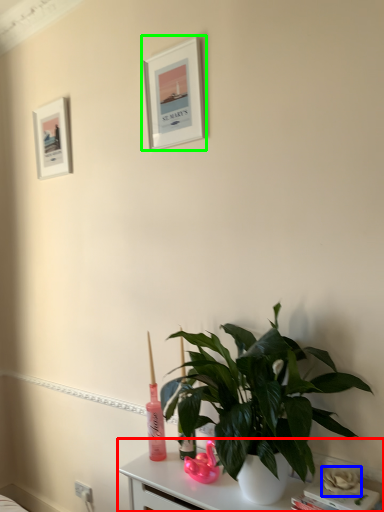
Question: Estimate the real-world distances between objects in this image. Which object is closer to table (highlighted by a red box), flower (highlighted by a blue box) or picture frame (highlighted by a green box)?

Choices:
 (A) flower
 (B) picture frame

Answer: (A)